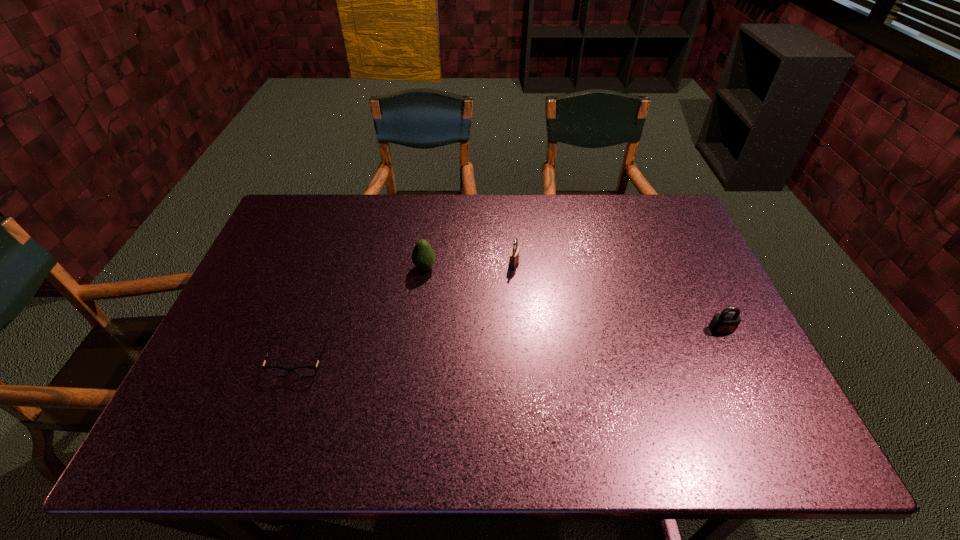
At what (x,y) coordinates should I click in order to perform the action: click on avocado. Please return your answer as a coordinate pair (x, y). This screenshot has width=960, height=540. Looking at the image, I should click on (423, 257).

Where is `the left padlock`? the left padlock is located at coordinates (514, 253).

Where is `the farther padlock`? the farther padlock is located at coordinates (514, 253).

The height and width of the screenshot is (540, 960). In order to click on the right padlock in this screenshot , I will do `click(723, 323)`.

The height and width of the screenshot is (540, 960). I want to click on the third farthest object, so click(x=723, y=323).

Where is `the leftmost object`? The image size is (960, 540). the leftmost object is located at coordinates (305, 371).

At what (x,y) coordinates should I click in order to perform the action: click on the shortest object. Please return your answer as a coordinate pair (x, y). This screenshot has height=540, width=960. Looking at the image, I should click on (305, 371).

Identify the location of blank space located on the left of the avocado. This screenshot has height=540, width=960. (319, 268).

I want to click on vacant area located on the right of the farther padlock, so click(x=573, y=264).

I want to click on vacant space located on the front of the nearer padlock near the keyhole, so click(x=769, y=427).